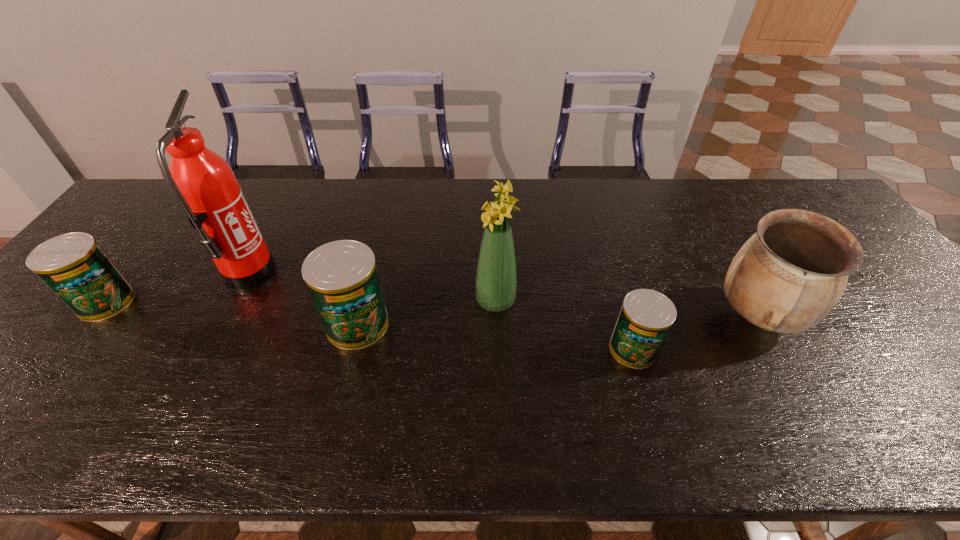
The width and height of the screenshot is (960, 540). Identify the location of urn. (789, 275).

Find the location of a particular element. Image resolution: width=960 pixels, height=540 pixels. free space located on the back of the leftmost object is located at coordinates (146, 251).

The image size is (960, 540). I want to click on free space located on the back of the fourth object from right to left, so click(x=370, y=276).

This screenshot has height=540, width=960. I want to click on vacant space located 0.260m on the back of the shortest can, so click(607, 257).

I want to click on vacant space located 0.130m on the label side of the fifth object from right to left, so click(x=320, y=272).

Find the location of `vacant region located 0.210m on the front-facing side of the third object from right to left`. vacant region located 0.210m on the front-facing side of the third object from right to left is located at coordinates point(395,301).

Find the location of a particular element. The height and width of the screenshot is (540, 960). free spot located 0.140m on the front-facing side of the third object from right to left is located at coordinates 421,301.

This screenshot has height=540, width=960. I want to click on free location located 0.160m on the front-facing side of the third object from right to left, so click(x=414, y=301).

Identify the location of vacant point located on the left of the rightmost object. (642, 315).

Image resolution: width=960 pixels, height=540 pixels. Find the location of `object that is at the near edge`. object that is at the near edge is located at coordinates (646, 316).